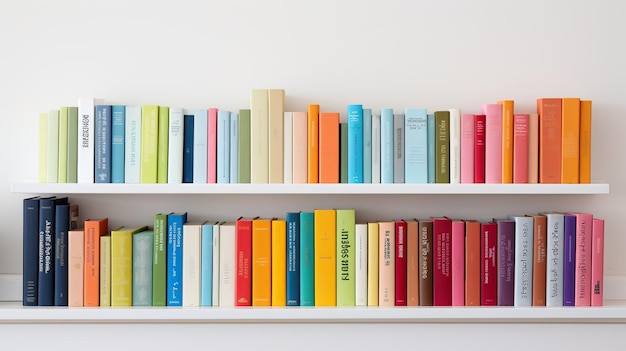
Find the location of a particular element. yellow books is located at coordinates (264, 249), (278, 251), (322, 256), (313, 170).